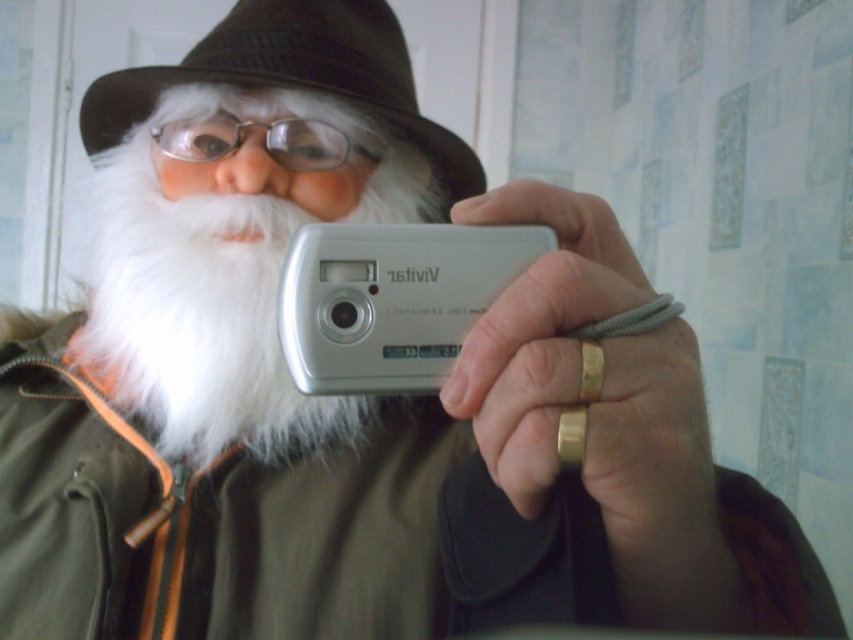
You are standing in front of a Santa Claus figure taking a selfie with a Vivitar camera. There are two points marked on the image at coordinates point (328, 214) and point (300, 60). Which point is nearer to the camera?

Point (328, 214) is closer to the camera than point (300, 60).

Consider the image. You are a photographer trying to capture a clear selfie with the Santa costume. The white fluffy beard at center and the black felt hat at upper center are both in the frame. Which object takes up more space in the photo?

The white fluffy beard at center takes up more space in the photo because it has a larger size compared to the black felt hat at upper center.

You are a photographer trying to capture a clear selfie of the Santa Claus costume. You notice the white fluffy beard at center and the clear plastic glasses at center. Which object is closer to the camera lens when taking the selfie?

The white fluffy beard at center is located below clear plastic glasses at center, so the clear plastic glasses at center are closer to the camera lens since they are positioned above the beard.